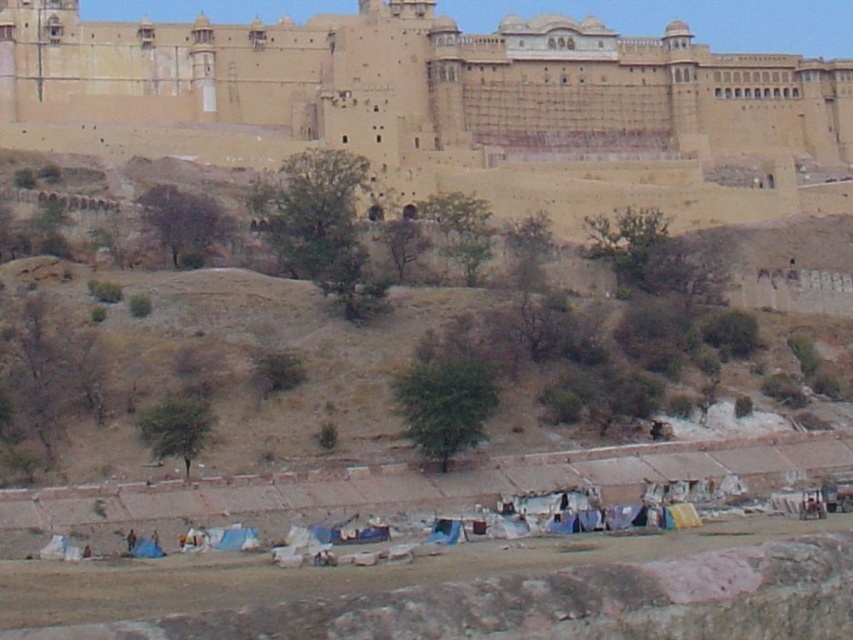
Question: Which point appears farthest from the camera in this image?

Choices:
 (A) (570, 29)
 (B) (474, 316)

Answer: (A)

Question: Observing the image, what is the correct spatial positioning of brown earthy hillside at center in reference to beige stone castle at upper center?

Choices:
 (A) below
 (B) above

Answer: (A)

Question: Observing the image, what is the correct spatial positioning of brown earthy hillside at center in reference to beige stone castle at upper center?

Choices:
 (A) right
 (B) left

Answer: (B)

Question: Which point appears farthest from the camera in this image?

Choices:
 (A) [x=215, y=413]
 (B) [x=671, y=106]

Answer: (B)

Question: Can you confirm if brown earthy hillside at center is thinner than beige stone castle at upper center?

Choices:
 (A) no
 (B) yes

Answer: (B)